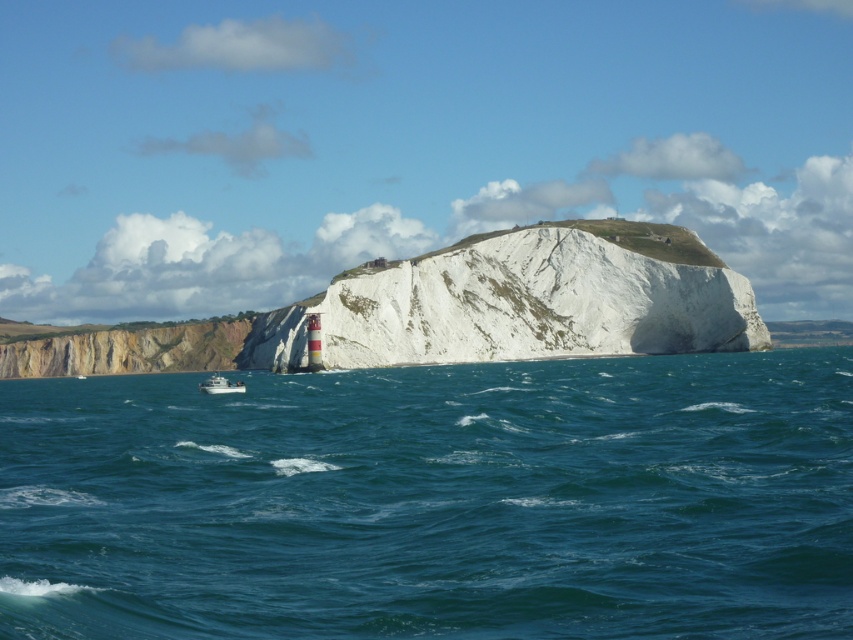
You are standing at the base of the yellowish rock cliff at lower left and want to reach the blue water at center. Which direction should you move in order to get there?

You should move to the right because the blue water at center is located to the right of the yellowish rock cliff at lower left.

You are a photographer standing at the cliff edge. You want to capture both the point at coordinates point (374, 268) and point (200, 353) in your photo. Which point will appear larger in the photo?

Point (374, 268) is closer to the camera, so it will appear larger in the photo than point (200, 353).

You are standing on a boat in the middle of the ocean looking at the scene. Which object is closer to you, the blue water at center or the yellowish rock cliff at lower left?

The blue water at center is closer to the viewer than the yellowish rock cliff at lower left according to the description.